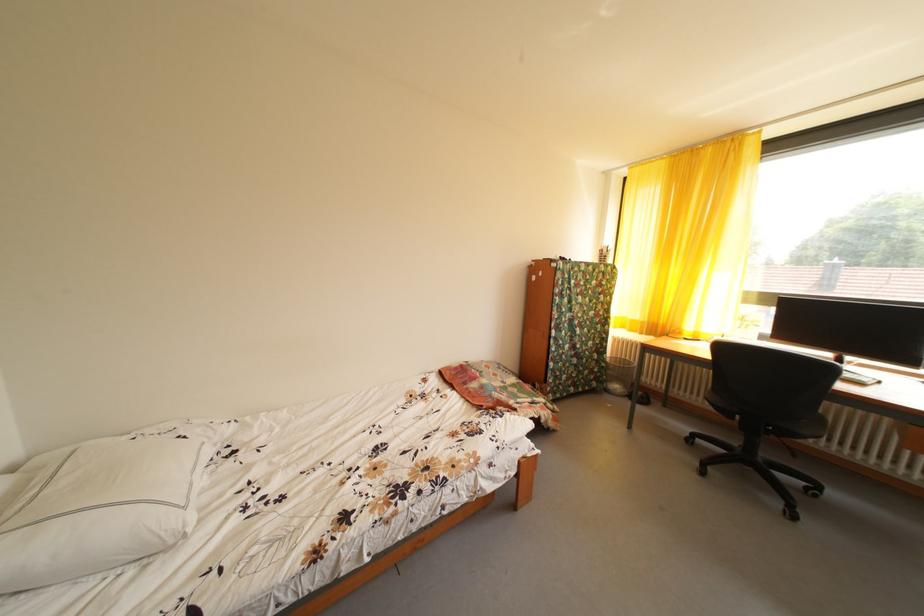
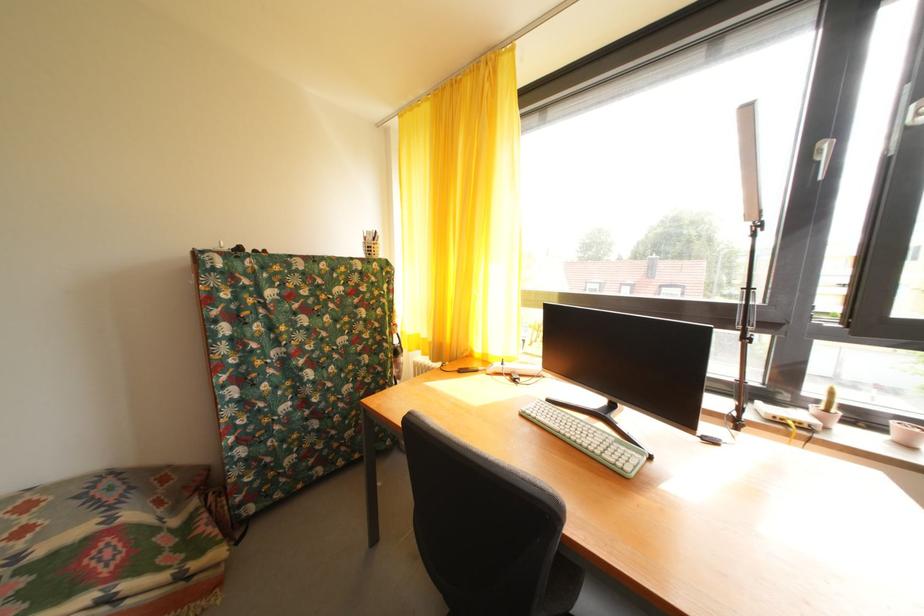
Locate, in the second image, the point that corresponds to point 504,381 in the first image.

(31, 538)